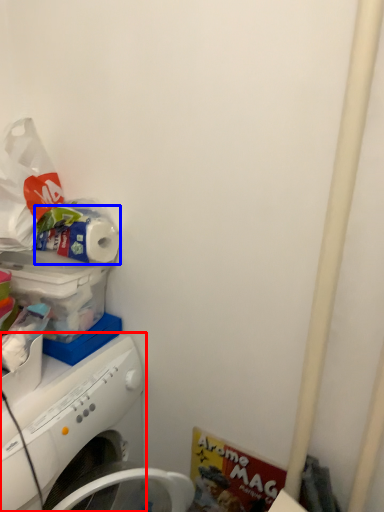
Question: Which point is further to the camera, washing machine (highlighted by a red box) or toilet paper (highlighted by a blue box)?

Choices:
 (A) washing machine
 (B) toilet paper

Answer: (B)